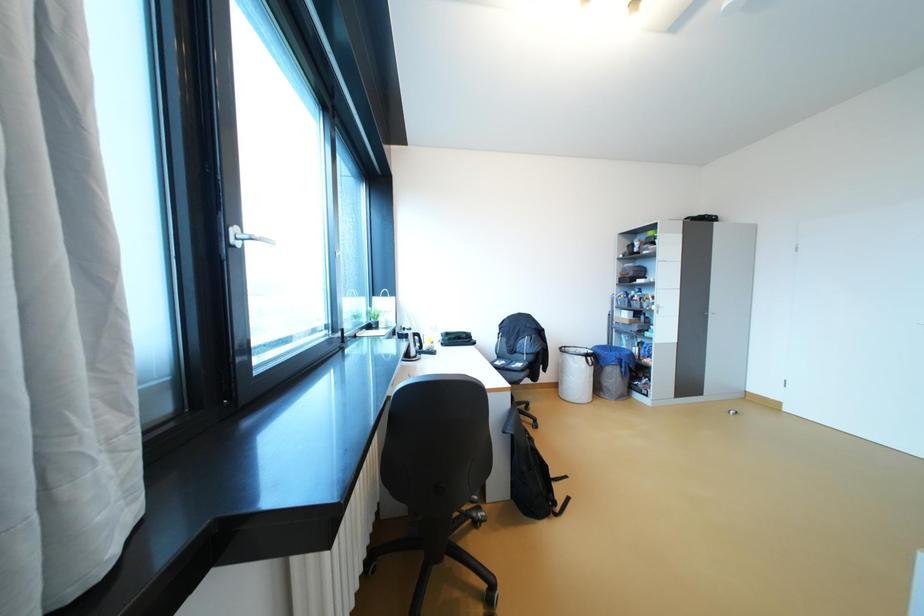
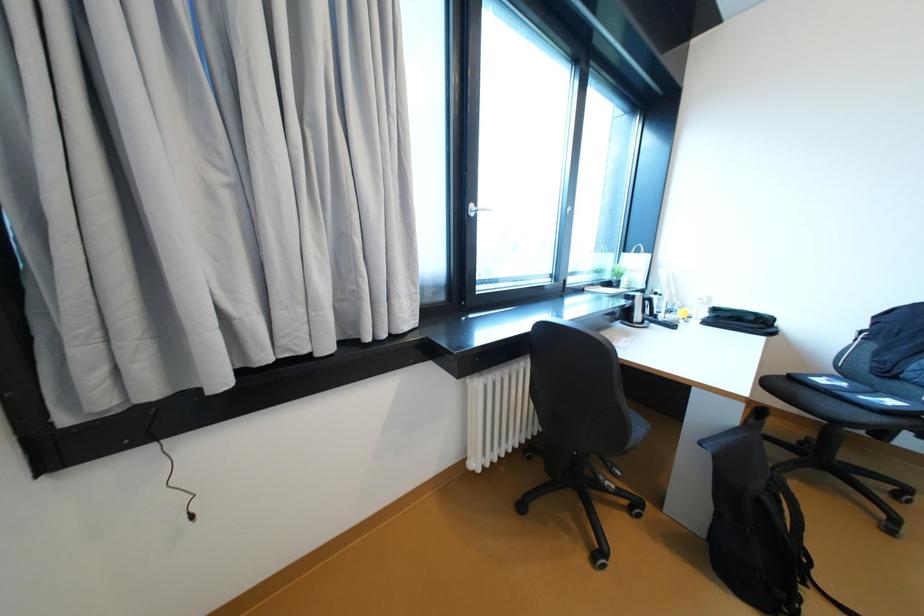
Question: How did the camera likely rotate?

Choices:
 (A) Left
 (B) Right
 (C) Up
 (D) Down

Answer: (A)